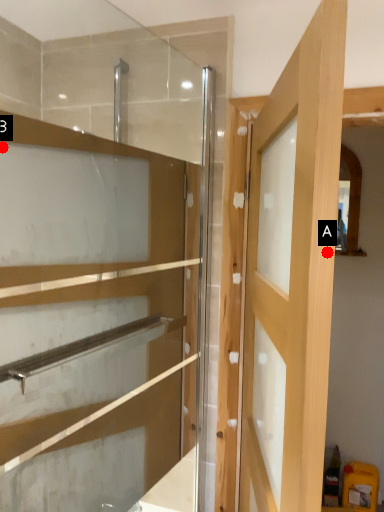
Question: Two points are circled on the image, labeled by A and B beside each circle. Which point is closer to the camera?

Choices:
 (A) A is closer
 (B) B is closer

Answer: (A)